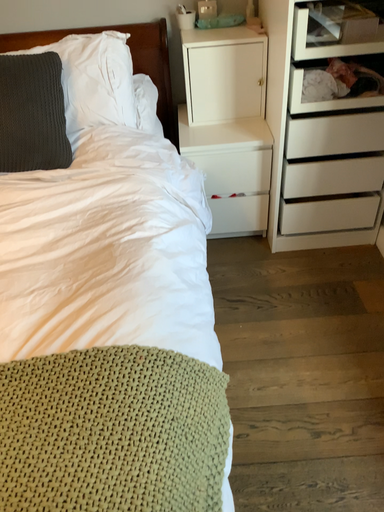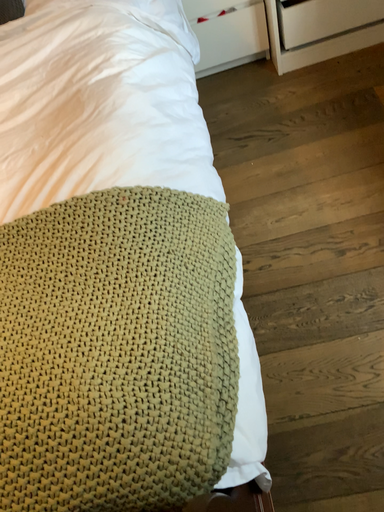
Question: How did the camera likely rotate when shooting the video?

Choices:
 (A) rotated downward
 (B) rotated upward

Answer: (A)